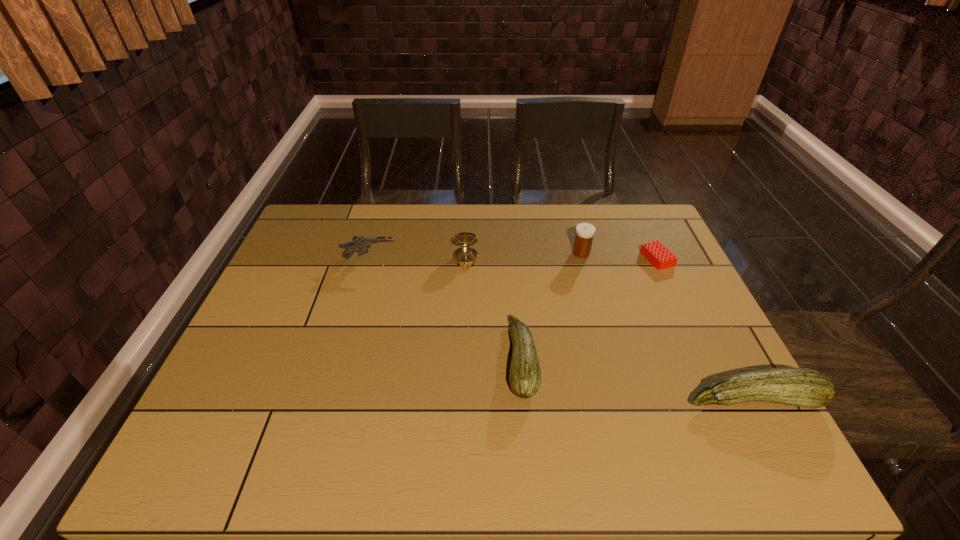
Identify the location of free space between the left zucchini and the medicine. Image resolution: width=960 pixels, height=540 pixels. (551, 306).

At what (x,y) coordinates should I click in order to perform the action: click on unoccupied position between the shortest object and the fifth object from right to left. Please return your answer as a coordinate pair (x, y). Image resolution: width=960 pixels, height=540 pixels. Looking at the image, I should click on (562, 259).

At what (x,y) coordinates should I click in order to perform the action: click on empty space between the medicine and the taller zucchini. Please return your answer as a coordinate pair (x, y). The height and width of the screenshot is (540, 960). Looking at the image, I should click on (667, 326).

What are the coordinates of `the closest object relative to the shortest object` in the screenshot? It's located at (584, 232).

I want to click on the second closest object relative to the taller zucchini, so (x=655, y=252).